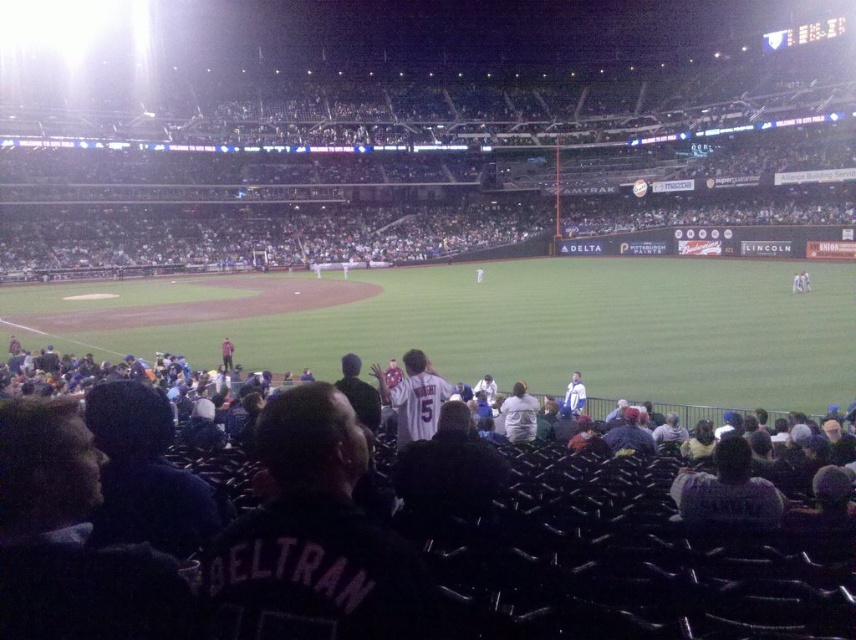
Does dark gray jacket at center appear over white jersey at center?

Incorrect, dark gray jacket at center is not positioned above white jersey at center.

In the scene shown: Between dark gray jacket at center and white jersey at center, which one appears on the right side from the viewer's perspective?

dark gray jacket at center is more to the right.

Where is `dark gray jacket at center`? This screenshot has height=640, width=856. dark gray jacket at center is located at coordinates (727, 492).

Locate an element on the screen. Image resolution: width=856 pixels, height=640 pixels. dark gray jacket at center is located at coordinates (727, 492).